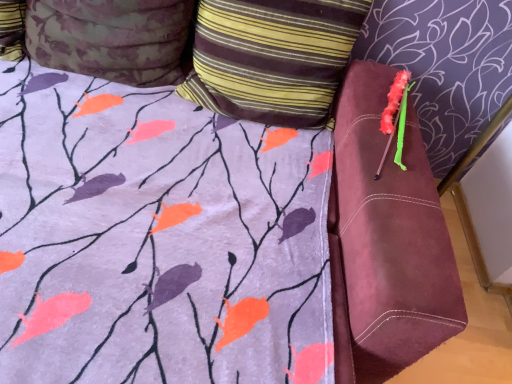
Question: Is point (380, 125) closer or farther from the camera than point (250, 112)?

Choices:
 (A) farther
 (B) closer

Answer: (B)

Question: In the image, is fluffy pink brush at upper right on the left side or the right side of striped fabric pillow at upper center, arranged as the second pillow when viewed from the left?

Choices:
 (A) left
 (B) right

Answer: (B)

Question: Which object is the farthest from the floral fabric pillow at upper left, arranged as the 1th pillow when viewed from the left?

Choices:
 (A) striped fabric pillow at upper center, marked as the first pillow in a right-to-left arrangement
 (B) fluffy pink brush at upper right

Answer: (B)

Question: Considering the real-world distances, which object is closest to the floral fabric pillow at upper left, which is the second pillow in right-to-left order?

Choices:
 (A) fluffy pink brush at upper right
 (B) striped fabric pillow at upper center, arranged as the second pillow when viewed from the left

Answer: (B)